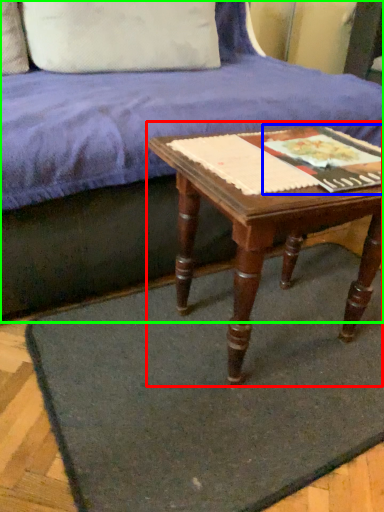
Question: Considering the real-world distances, which object is farthest from table (highlighted by a red box)? paperback book (highlighted by a blue box) or studio couch (highlighted by a green box)?

Choices:
 (A) paperback book
 (B) studio couch

Answer: (B)